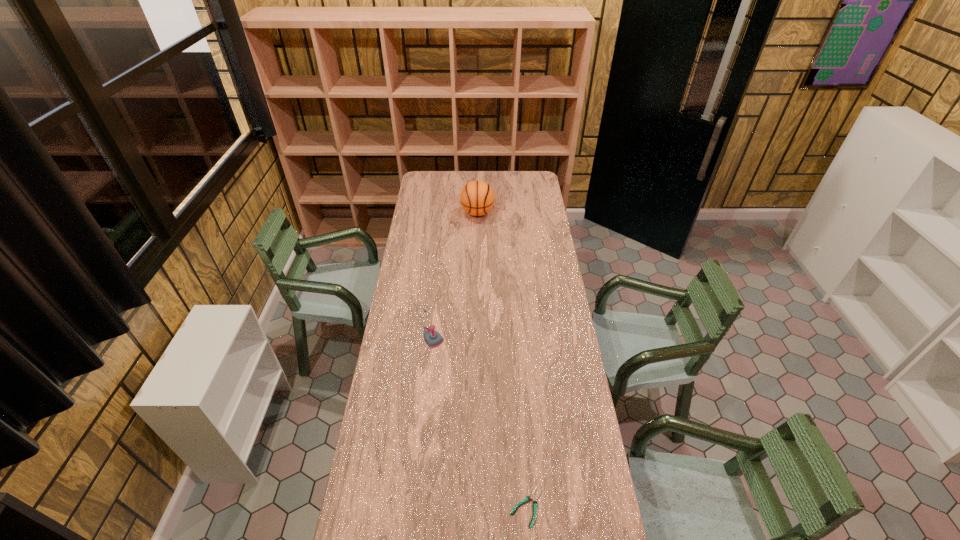
Locate an element on the screen. the second closest object to the nearest object is located at coordinates [477, 198].